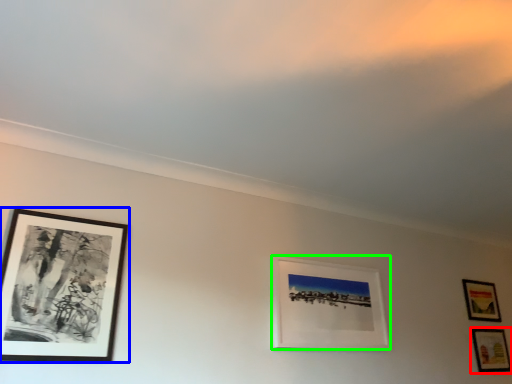
Question: Based on their relative distances, which object is nearer to picture frame (highlighted by a red box)? Choose from picture frame (highlighted by a blue box) and picture frame (highlighted by a green box).

Choices:
 (A) picture frame
 (B) picture frame

Answer: (B)